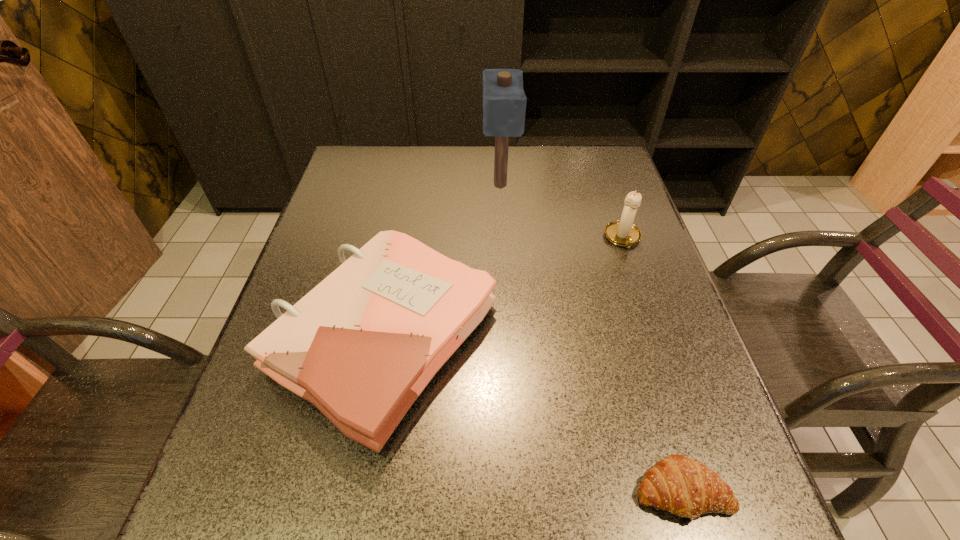
This screenshot has width=960, height=540. In order to click on vacant space located 0.080m on the right of the second shortest object in this screenshot , I will do `click(536, 338)`.

Find the location of a particular element. This screenshot has width=960, height=540. vacant space situated 0.220m on the left of the shortest object is located at coordinates (499, 491).

Locate an element on the screen. Image resolution: width=960 pixels, height=540 pixels. object at the far edge is located at coordinates (504, 101).

This screenshot has width=960, height=540. I want to click on object located at the near edge, so click(x=677, y=484).

Locate an element on the screen. object present at the left edge is located at coordinates (361, 346).

Find the location of a particular element. candle holder located at the right edge is located at coordinates (623, 233).

Locate an element on the screen. The height and width of the screenshot is (540, 960). crescent roll present at the right edge is located at coordinates (677, 484).

This screenshot has height=540, width=960. Find the location of `object present at the near right corner`. object present at the near right corner is located at coordinates (677, 484).

In order to click on vacant area at the far edge of the desktop in this screenshot , I will do `click(491, 151)`.

In the image, there is a desktop. Identify the location of blank space at the near edge. The height and width of the screenshot is (540, 960). (498, 509).